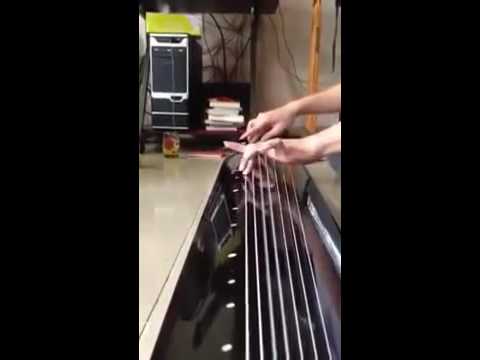
Locate an element on the screen. This screenshot has width=480, height=360. books is located at coordinates (226, 103), (221, 110), (222, 119), (222, 122), (223, 127).